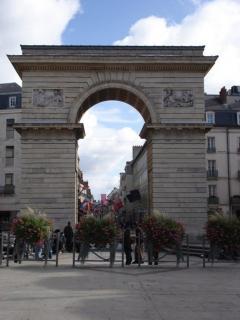
Where is `top of arch`? The width and height of the screenshot is (240, 320). top of arch is located at coordinates (108, 48).